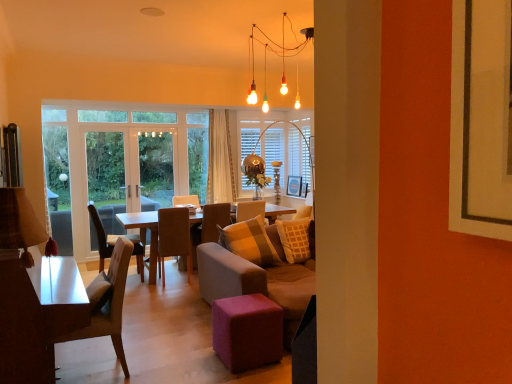
Question: From a real-world perspective, is white sheer curtain at center below brown fabric chair at center, which ranks as the 2th chair in back-to-front order?

Choices:
 (A) no
 (B) yes

Answer: (A)

Question: From the image's perspective, is white sheer curtain at center beneath brown fabric chair at center, which ranks as the 2th chair in back-to-front order?

Choices:
 (A) yes
 (B) no

Answer: (B)

Question: Does white sheer curtain at center appear on the left side of brown fabric chair at center, which is the 3th chair from front to back?

Choices:
 (A) yes
 (B) no

Answer: (B)

Question: Is white sheer curtain at center positioned before brown fabric chair at center, which is the 3th chair from front to back?

Choices:
 (A) no
 (B) yes

Answer: (A)

Question: Is white sheer curtain at center taller than brown fabric chair at center, which is the 3th chair from front to back?

Choices:
 (A) no
 (B) yes

Answer: (B)

Question: Can you confirm if white sheer curtain at center is wider than brown fabric chair at center, which ranks as the 2th chair in back-to-front order?

Choices:
 (A) yes
 (B) no

Answer: (B)

Question: From the image's perspective, is translucent glass window at center located above white glossy table at left?

Choices:
 (A) no
 (B) yes

Answer: (B)

Question: Can you confirm if translucent glass window at center is positioned to the left of white glossy table at left?

Choices:
 (A) no
 (B) yes

Answer: (A)

Question: Would you say translucent glass window at center is outside white glossy table at left?

Choices:
 (A) no
 (B) yes

Answer: (B)

Question: From a real-world perspective, is translucent glass window at center under white glossy table at left?

Choices:
 (A) yes
 (B) no

Answer: (B)

Question: Considering the relative sizes of translucent glass window at center and white glossy table at left in the image provided, is translucent glass window at center taller than white glossy table at left?

Choices:
 (A) no
 (B) yes

Answer: (B)

Question: Could you tell me if translucent glass window at center is turned towards white glossy table at left?

Choices:
 (A) no
 (B) yes

Answer: (A)

Question: From a real-world perspective, is translucent glass window at center located beneath transparent glass door at left, placed as the 1th screen door when sorted from left to right?

Choices:
 (A) yes
 (B) no

Answer: (B)